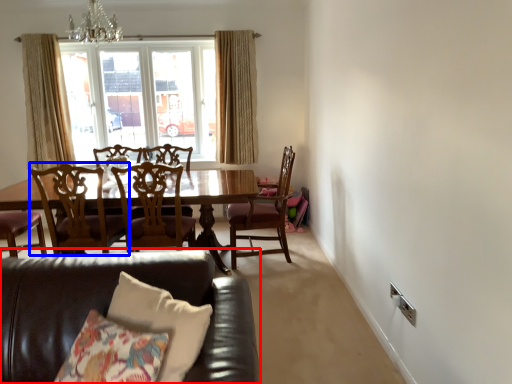
Question: Among these objects, which one is nearest to the camera, studio couch (highlighted by a red box) or chair (highlighted by a blue box)?

Choices:
 (A) studio couch
 (B) chair

Answer: (A)